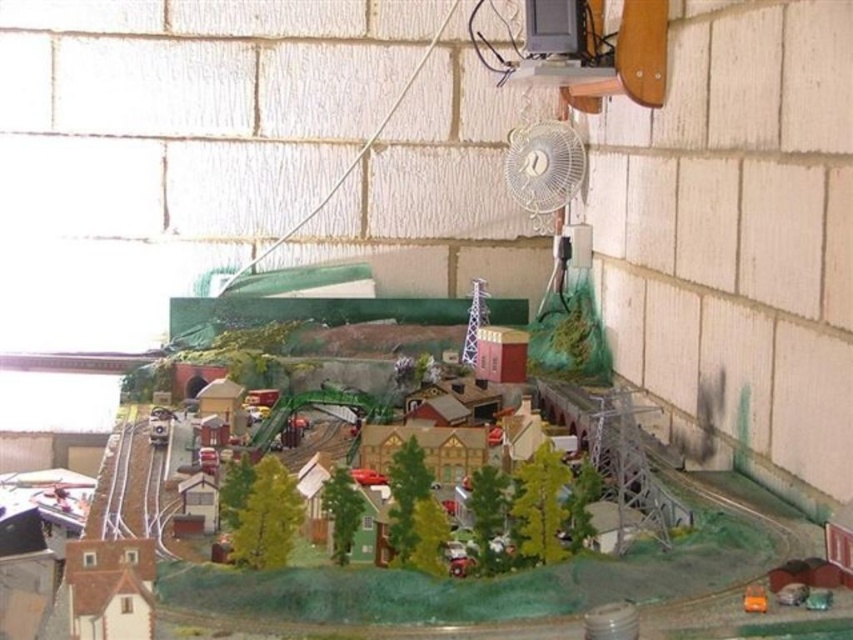
You are a model train enthusiast who wants to place a new miniature building exactly 0.1 units to the right and 0.05 units above the white plastic fan at upper center. What are the coordinates where you should place the new building?

The coordinates for placing the new building would be calculated by adding 0.1 to the x coordinate and 0.05 to the y coordinate of the white plastic fan at upper center. The original coordinates are at point (543, 168). Adding 0.1 to the x gives 0.364, and adding 0.05 to the y gives 0.688. Therefore, the new coordinates are (585, 232).

You are a model train enthusiast who wants to place a new toy car next to the white plastic train track at lower left and the orange matte toy at lower right. Considering their heights, which object should you place the toy car closer to to avoid blocking the train track?

The white plastic train track at lower left is taller than the orange matte toy at lower right, so placing the toy car closer to the orange matte toy at lower right would avoid blocking the train track.

You are a model train enthusiast who wants to adjust the fan to prevent it from blowing debris onto the train track. Which object should you move closer to you, the white plastic fan at upper center or the white plastic train track at lower left?

You should move the white plastic fan at upper center closer to you because it is already closer to you than the white plastic train track at lower left. Moving it further away would not help, but moving the track closer might interfere with the train operation.